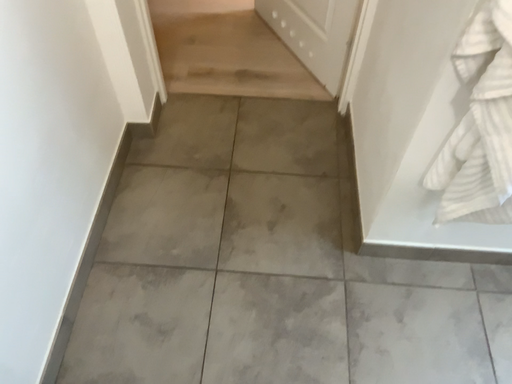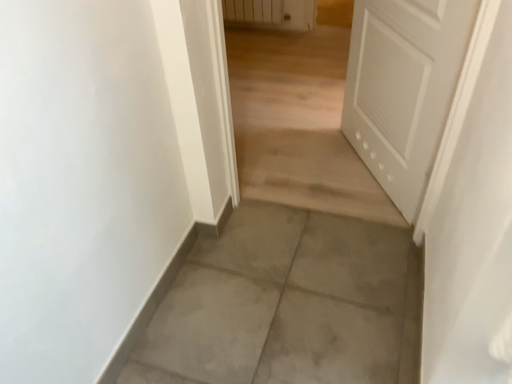
Question: Which way did the camera rotate in the video?

Choices:
 (A) rotated right
 (B) rotated left

Answer: (B)